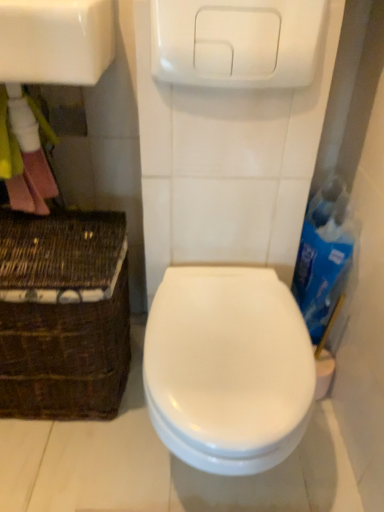
Question: Does white glossy sink at upper left have a lesser width compared to white glossy toilet at center?

Choices:
 (A) yes
 (B) no

Answer: (A)

Question: From the image's perspective, is white glossy sink at upper left located above white glossy toilet at center?

Choices:
 (A) yes
 (B) no

Answer: (A)

Question: Is white glossy sink at upper left in contact with white glossy toilet at center?

Choices:
 (A) yes
 (B) no

Answer: (B)

Question: From a real-world perspective, is white glossy sink at upper left located beneath white glossy toilet at center?

Choices:
 (A) yes
 (B) no

Answer: (B)

Question: Is white glossy sink at upper left smaller than white glossy toilet at center?

Choices:
 (A) no
 (B) yes

Answer: (B)

Question: Considering their positions, is brown woven basket at lower left located in front of or behind white glossy sink at upper left?

Choices:
 (A) front
 (B) behind

Answer: (B)

Question: From their relative heights in the image, would you say brown woven basket at lower left is taller or shorter than white glossy sink at upper left?

Choices:
 (A) short
 (B) tall

Answer: (B)

Question: From a real-world perspective, relative to white glossy sink at upper left, is brown woven basket at lower left vertically above or below?

Choices:
 (A) above
 (B) below

Answer: (B)

Question: From the image's perspective, is brown woven basket at lower left located above or below white glossy sink at upper left?

Choices:
 (A) above
 (B) below

Answer: (B)

Question: In terms of size, does blue cardboard box at right appear bigger or smaller than brown woven basket at lower left?

Choices:
 (A) small
 (B) big

Answer: (A)

Question: Would you say blue cardboard box at right is to the left or to the right of brown woven basket at lower left in the picture?

Choices:
 (A) right
 (B) left

Answer: (A)

Question: In terms of height, does blue cardboard box at right look taller or shorter compared to brown woven basket at lower left?

Choices:
 (A) tall
 (B) short

Answer: (B)

Question: Is point pyautogui.click(x=304, y=310) closer or farther from the camera than point pyautogui.click(x=107, y=283)?

Choices:
 (A) farther
 (B) closer

Answer: (A)

Question: Considering their positions, is white glossy sink at upper left located in front of or behind brown woven basket at lower left?

Choices:
 (A) behind
 (B) front

Answer: (B)

Question: From the image's perspective, relative to brown woven basket at lower left, is white glossy sink at upper left above or below?

Choices:
 (A) below
 (B) above

Answer: (B)